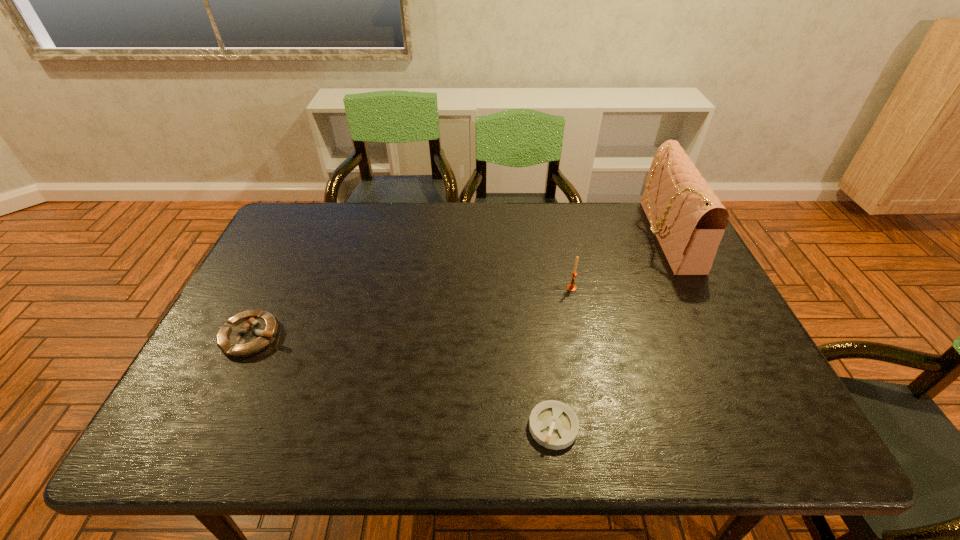
Locate an element on the screen. The image size is (960, 540). vacant space located 0.090m on the front-facing side of the handbag is located at coordinates (616, 235).

I want to click on vacant space located on the left of the candle_holder, so click(435, 288).

This screenshot has height=540, width=960. I want to click on vacant region located 0.140m on the right of the farther ashtray, so click(x=339, y=336).

Find the location of a particular element. This screenshot has height=540, width=960. free region located 0.110m on the left of the nearer ashtray is located at coordinates (477, 427).

Where is `object at the far edge`? Image resolution: width=960 pixels, height=540 pixels. object at the far edge is located at coordinates (688, 219).

Where is `object located at the near edge`? This screenshot has height=540, width=960. object located at the near edge is located at coordinates (553, 424).

This screenshot has width=960, height=540. In order to click on object located in the left edge section of the desktop in this screenshot , I will do `click(247, 333)`.

Find the location of `object at the right edge`. object at the right edge is located at coordinates (688, 219).

Find the location of a particular element. The image size is (960, 540). object at the far right corner is located at coordinates (688, 219).

What are the coordinates of `free location at the far edge` in the screenshot? It's located at (492, 244).